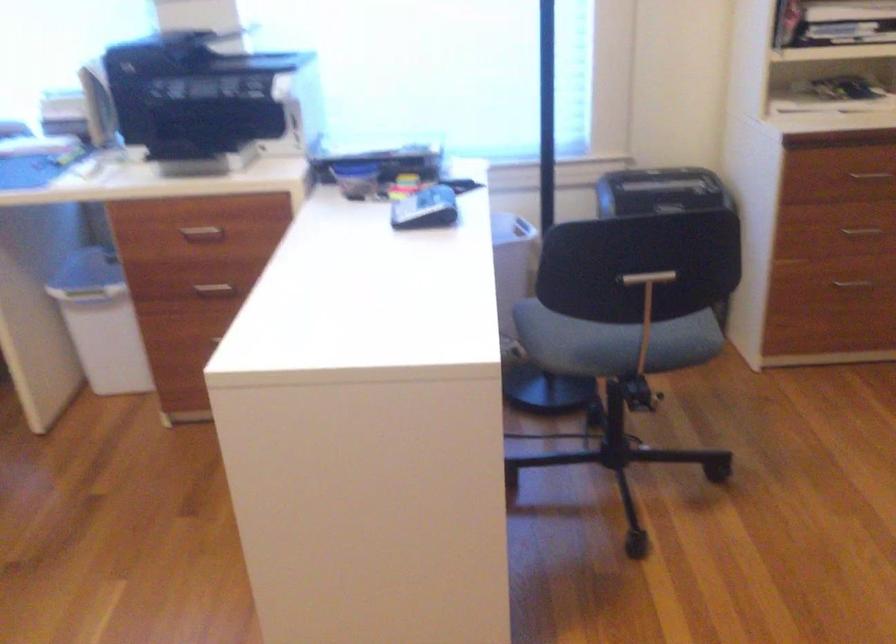
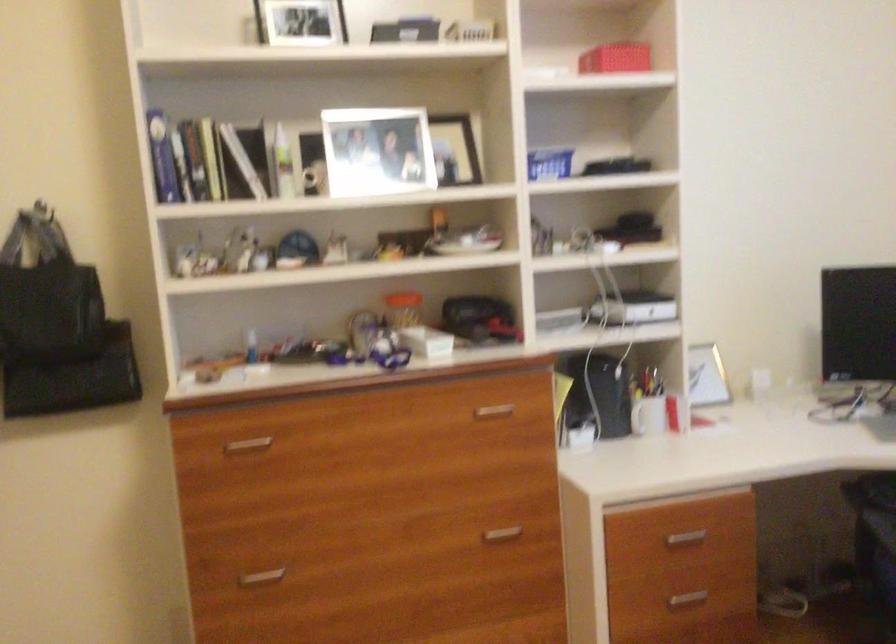
Question: The camera is either moving clockwise (left) or counter-clockwise (right) around the object. The first image is from the beginning of the video and the second image is from the end. Is the camera moving left or right when shooting the video?

Choices:
 (A) Left
 (B) Right

Answer: (B)